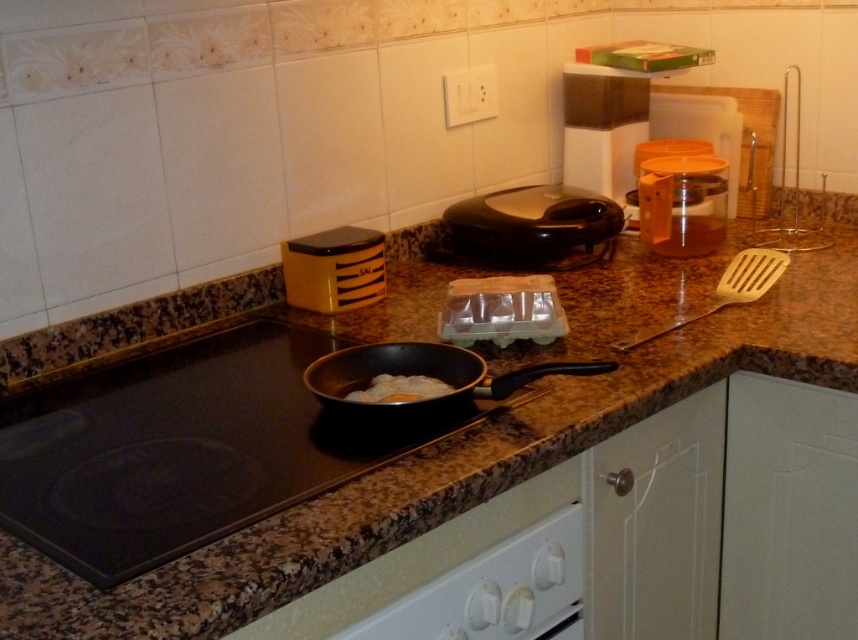
Question: Can you confirm if black glossy rice cooker at center is smaller than black matte wok at center?

Choices:
 (A) yes
 (B) no

Answer: (B)

Question: Among these objects, which one is farthest from the camera?

Choices:
 (A) white fluffy food at pan center
 (B) brown granite countertop at center
 (C) transparent plastic container at center-right
 (D) black matte wok at center

Answer: (C)

Question: Is the position of yellow matte container at center less distant than that of white fluffy food at pan center?

Choices:
 (A) no
 (B) yes

Answer: (A)

Question: Can you confirm if transparent plastic container at center-right is positioned below white fluffy food at pan center?

Choices:
 (A) no
 (B) yes

Answer: (A)

Question: Among these objects, which one is farthest from the camera?

Choices:
 (A) white fluffy food at pan center
 (B) yellow matte container at center
 (C) transparent plastic container at center-right
 (D) wooden spatula at right

Answer: (C)

Question: Which of the following is the farthest from the observer?

Choices:
 (A) white fluffy food at pan center
 (B) yellow matte container at center
 (C) black glossy rice cooker at center
 (D) transparent plastic container at center-right

Answer: (C)